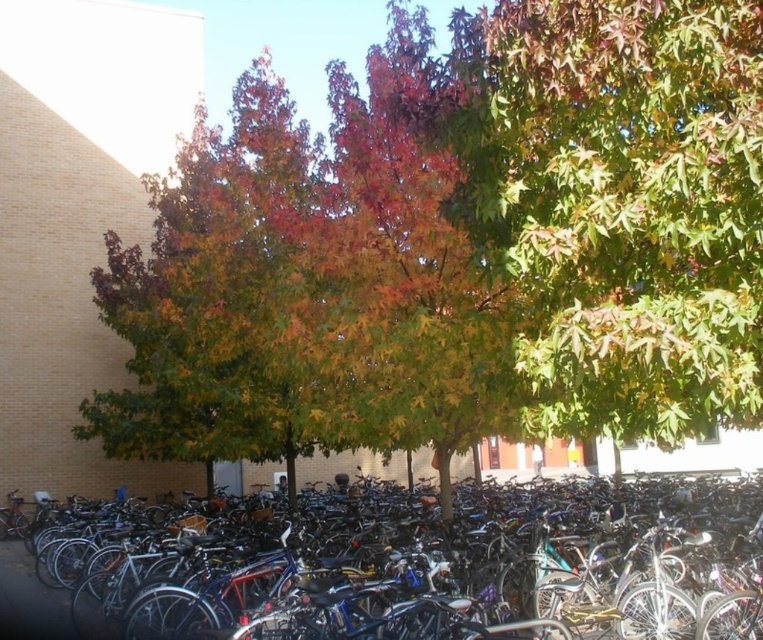
Does multicolored foliage at center have a larger size compared to green matte tree at center?

Correct, multicolored foliage at center is larger in size than green matte tree at center.

In the scene shown: Who is higher up, multicolored foliage at center or green matte tree at center?

multicolored foliage at center is above.

Between point (526, 342) and point (649, 179), which one is positioned behind?

The point (526, 342) is behind.

Identify the location of multicolored foliage at center. The width and height of the screenshot is (763, 640). (462, 241).

I want to click on multicolored foliage at center, so click(462, 241).

Is multicolored foliage at center further to camera compared to shiny metallic bicycle at center?

No, it is not.

Is point (417, 28) positioned after point (491, 557)?

Yes, point (417, 28) is behind point (491, 557).

In order to click on multicolored foliage at center in this screenshot , I will do `click(462, 241)`.

Who is more distant from viewer, (675, 90) or (337, 529)?

Positioned behind is point (337, 529).

Can you confirm if green matte tree at center is shorter than shiny metallic bicycle at center?

Correct, green matte tree at center is not as tall as shiny metallic bicycle at center.

Identify the location of green matte tree at center. (629, 209).